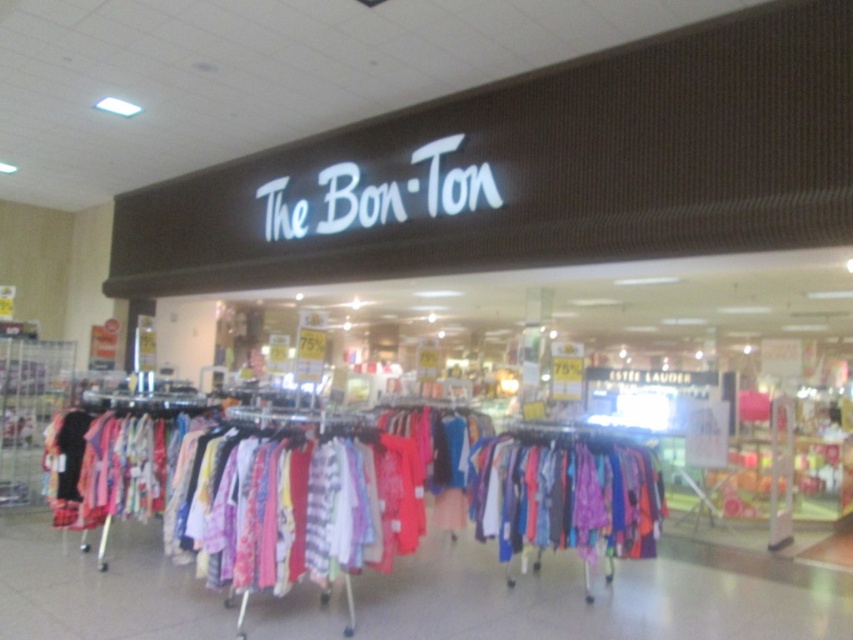
Question: Is brightly colored fabric at center to the left of multicolored fabric dress at center from the viewer's perspective?

Choices:
 (A) yes
 (B) no

Answer: (A)

Question: Which object is closer to the camera taking this photo?

Choices:
 (A) multicolored fabric dress at center
 (B) brightly colored fabric at center

Answer: (B)

Question: Can you confirm if brightly colored fabric at center is smaller than multicolored fabric dress at center?

Choices:
 (A) yes
 (B) no

Answer: (B)

Question: Considering the relative positions of brightly colored fabric at center and multicolored fabric dress at center in the image provided, where is brightly colored fabric at center located with respect to multicolored fabric dress at center?

Choices:
 (A) above
 (B) below

Answer: (A)

Question: Which point is farther from the camera taking this photo?

Choices:
 (A) (471, 465)
 (B) (598, 547)

Answer: (A)